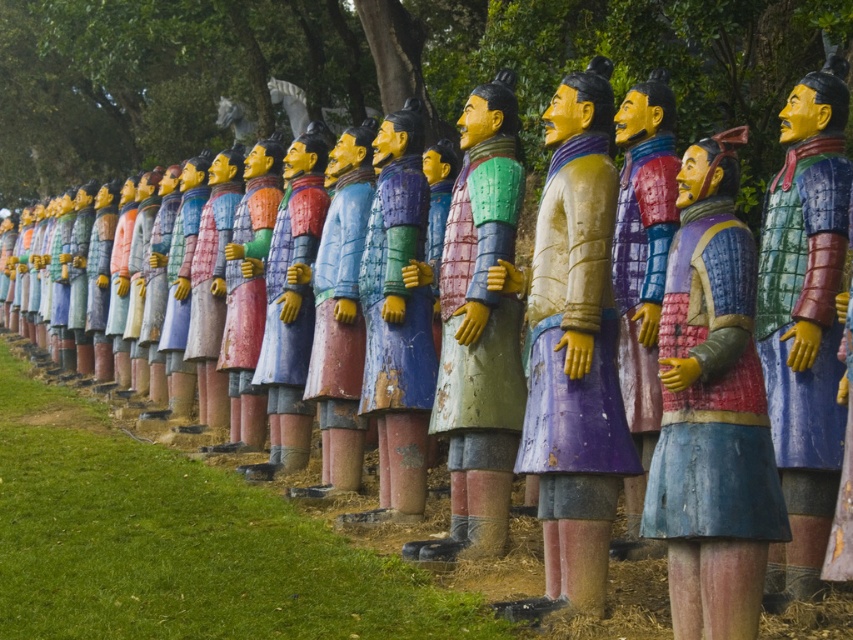
You are an art conservator assessing the statues in the image. You need to determine which object is taller between the wooden figure at center and the matte blue armor at center. Which one is taller?

The matte blue armor at center is taller than the wooden figure at center.

You are an art curator planning to display the matte painted figure at center and the matte wooden statue at center in an exhibition. Which of the two statues is shorter?

The matte painted figure at center is shorter than the matte wooden statue at center.

You are standing in front of the row of life sized statues. There is a point at coordinates (804, 323). Which object is this point located on?

The point at coordinates (804, 323) is located on the wooden armor figure at center.